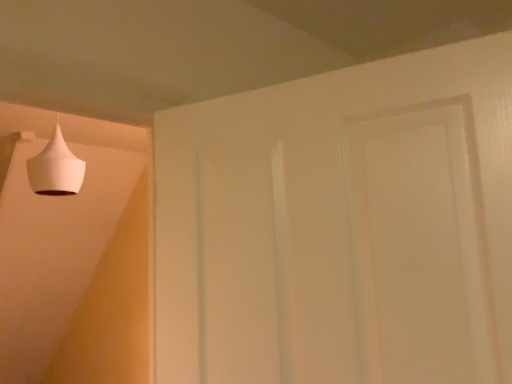
Where is `white matte cone at upper left`? The width and height of the screenshot is (512, 384). white matte cone at upper left is located at coordinates (56, 168).

This screenshot has width=512, height=384. Describe the element at coordinates (56, 168) in the screenshot. I see `white matte cone at upper left` at that location.

At what (x,y) coordinates should I click in order to perform the action: click on white matte cone at upper left. Please return your answer as a coordinate pair (x, y). Looking at the image, I should click on (56, 168).